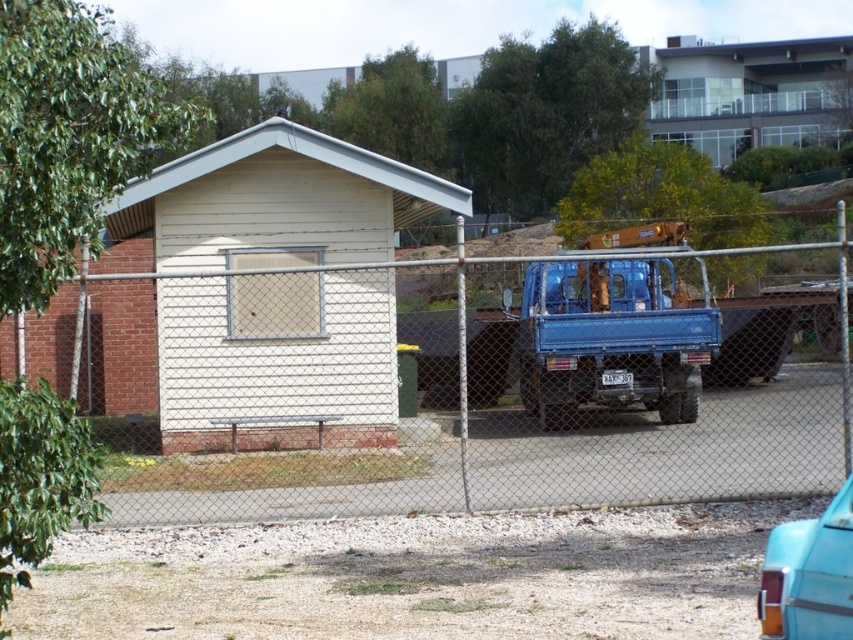
Based on the photo, you are a delivery driver who needs to park your teal glossy car at lower right next to the blue matte truck at center. Is there enough space between them for another vehicle to pass through?

The blue matte truck at center is smaller than teal glossy car at lower right. However, the question is about space between them for another vehicle to pass. Since the truck is smaller, the space might be limited. But without specific measurements, we can only infer based on size. If the teal car is larger, the gap might be insufficient. The answer should state that based on the description, the truck is smaller, so the space between them may not be enough for another vehicle to pass, but this is an infer.